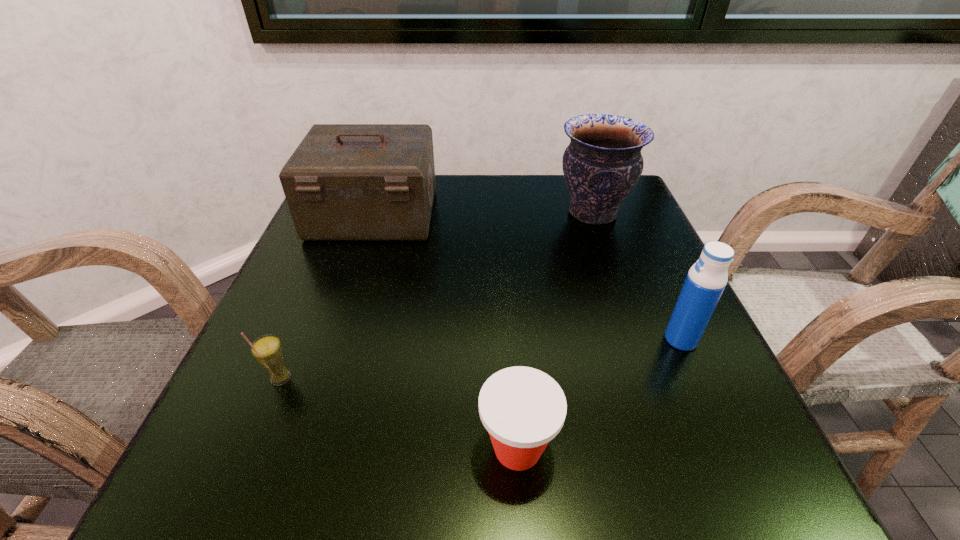
Locate an element on the screen. Image resolution: width=960 pixels, height=540 pixels. pottery is located at coordinates (602, 164).

You are a GUI agent. You are given a task and a screenshot of the screen. Output one action in this format:
    pyautogui.click(x=<x>, y=<y>)
    Task: Click on the first-aid kit
    This screenshot has height=540, width=960.
    Given the screenshot: What is the action you would take?
    pyautogui.click(x=344, y=182)

Find the location of a particular element. The image size is (960, 540). water bottle is located at coordinates (706, 280).

The image size is (960, 540). I want to click on the second nearest object, so click(267, 350).

Find the location of a particular element. the third object from right to left is located at coordinates (522, 408).

Where is `the nearest object`? The width and height of the screenshot is (960, 540). the nearest object is located at coordinates (522, 408).

Locate an element on the screen. The width and height of the screenshot is (960, 540). vacant region located on the front handle of the pottery is located at coordinates (494, 213).

Find the location of a particular element. free region located 0.370m on the front handle of the pottery is located at coordinates (396, 213).

Where is `vacant space located 0.270m on the front handle of the pottery`? Image resolution: width=960 pixels, height=540 pixels. vacant space located 0.270m on the front handle of the pottery is located at coordinates (439, 213).

This screenshot has height=540, width=960. I want to click on vacant area situated 0.150m on the front of the first-aid kit, so click(x=348, y=294).